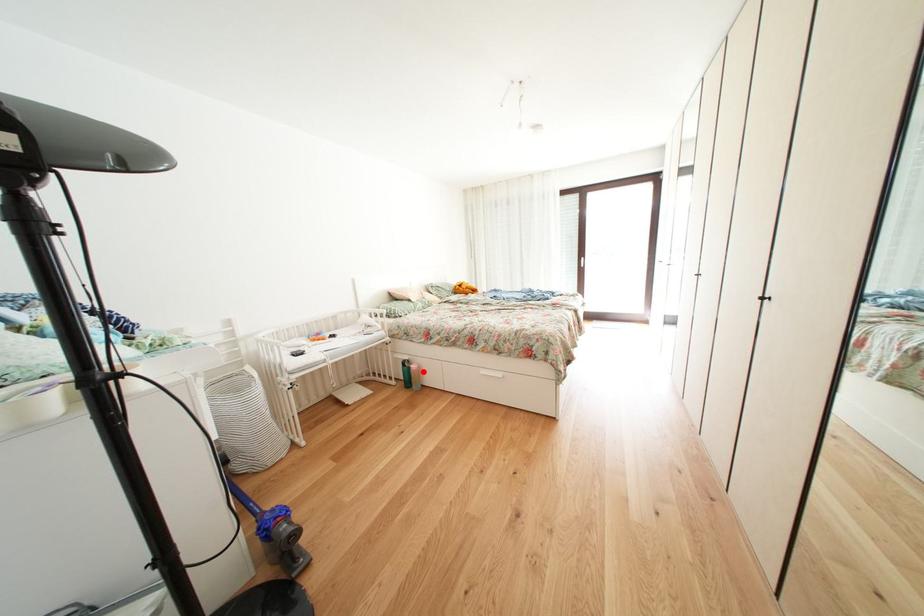
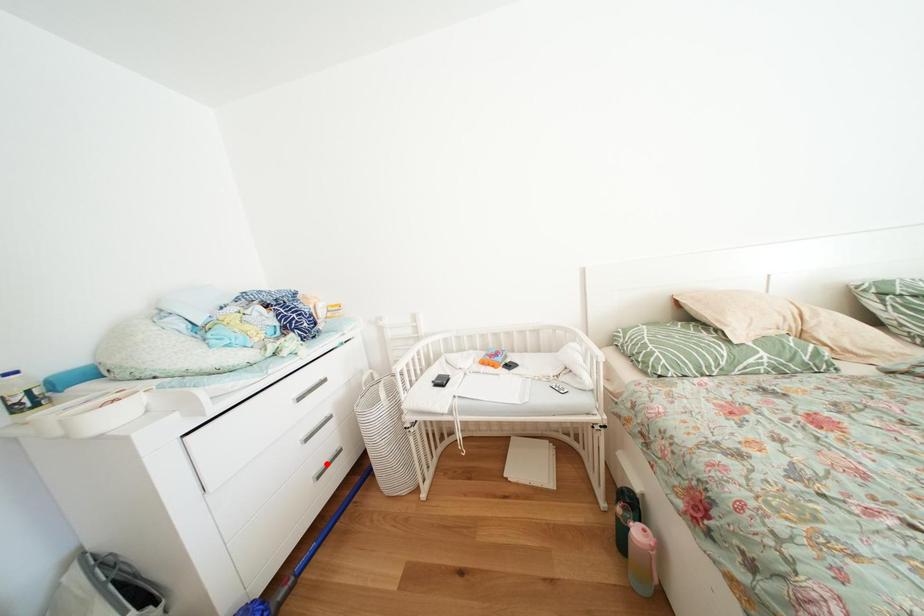
I am providing you with two images of the same scene from different viewpoints. A red point is marked on the first image and another point is marked on the second image. Do the highlighted points in image1 and image2 indicate the same real-world spot?

No